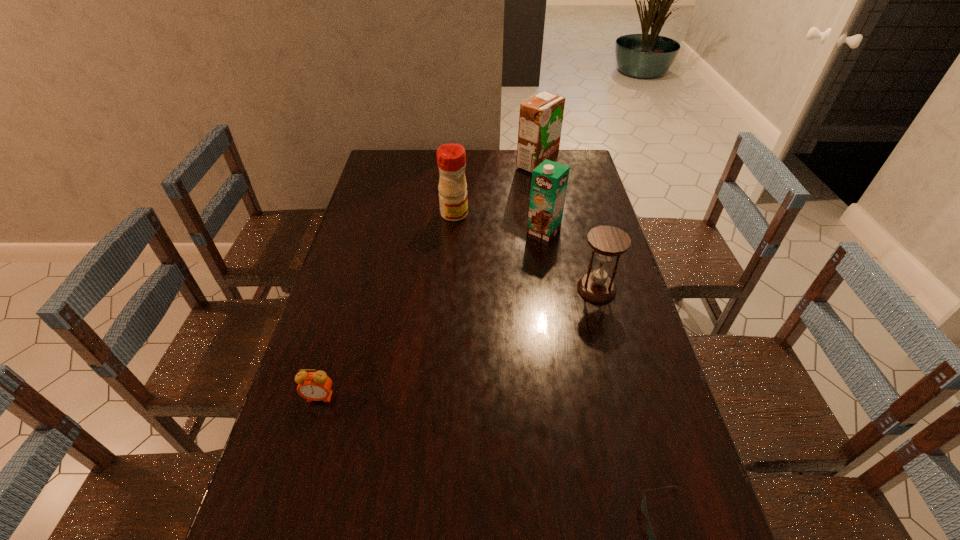
Where is `free space that satisfies the following two spatial constraints: 1. on the straw side of the farthest object; 2. on the left side of the hourglass`? This screenshot has width=960, height=540. free space that satisfies the following two spatial constraints: 1. on the straw side of the farthest object; 2. on the left side of the hourglass is located at coordinates (560, 289).

Where is `vacant region that satisfies the following two spatial constraints: 1. on the straw side of the farthest object; 2. on the face of the leftmost object`? vacant region that satisfies the following two spatial constraints: 1. on the straw side of the farthest object; 2. on the face of the leftmost object is located at coordinates (579, 397).